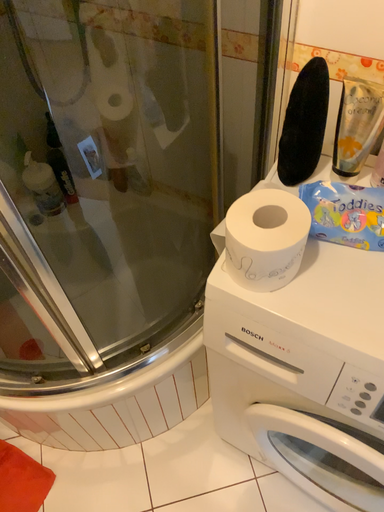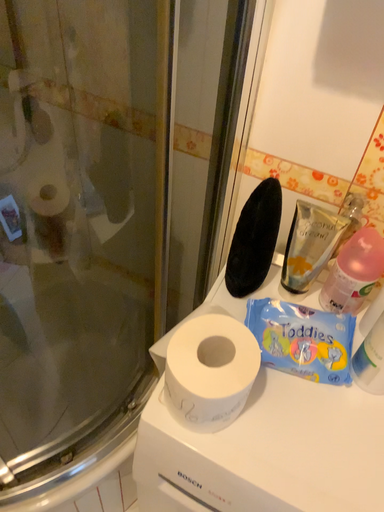
Question: How did the camera likely rotate when shooting the video?

Choices:
 (A) rotated right
 (B) rotated left

Answer: (A)